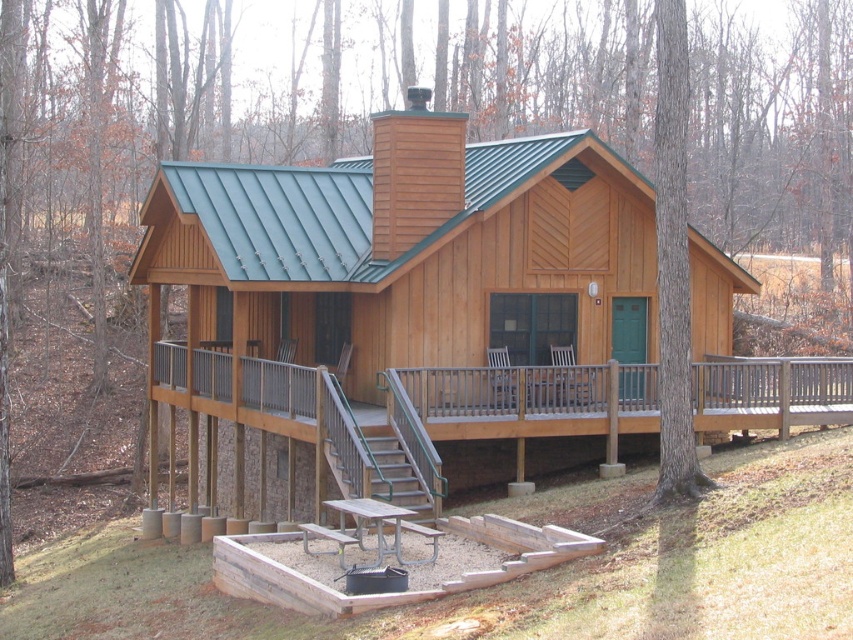
You are standing in front of the cabin and notice a specific location marked by coordinates. Can you identify what is located at the point with coordinates [512,410]?

The point at coordinates [512,410] marks the brown wooden porch at lower center of the cabin.

You are standing in front of the rustic wooden cabin and want to place a small potted plant between the two points marked as point (387, 406) and point (393, 483). Which point should the plant be closer to so that it appears closer to you?

The plant should be placed closer to point (387, 406) because it is closer to the viewer than point (393, 483).